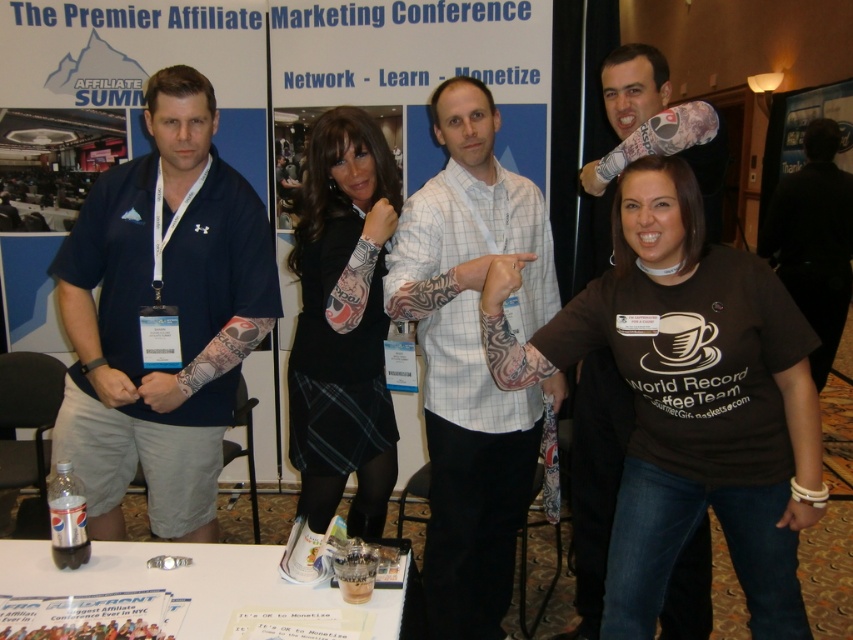
Question: Does brown cotton t-shirt at center appear under clear plastic cup at lower center?

Choices:
 (A) yes
 (B) no

Answer: (B)

Question: Estimate the real-world distances between objects in this image. Which object is farther from the matte blue shirt at left?

Choices:
 (A) black matte dress at center
 (B) black shirt at right

Answer: (B)

Question: Which object is positioned closest to the brown cotton t-shirt at center?

Choices:
 (A) white checkered shirt at center
 (B) black shirt at right

Answer: (A)

Question: Which is farther from the clear plastic cup at lower center?

Choices:
 (A) brown cotton t-shirt at center
 (B) matte blue shirt at left
 (C) black shirt at right
 (D) dark blue shirt at center

Answer: (C)

Question: Does dark blue shirt at center lie in front of black shirt at right?

Choices:
 (A) no
 (B) yes

Answer: (B)

Question: Where is brown cotton t-shirt at center located in relation to clear plastic cup at lower center in the image?

Choices:
 (A) above
 (B) below

Answer: (A)